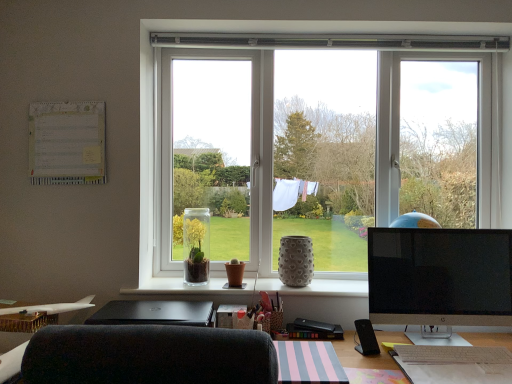
You are a GUI agent. You are given a task and a screenshot of the screen. Output one action in this format:
    pyautogui.click(x=<x>, y=<y>)
    Task: Click on the blank space situated above matte black stapler at lower center (from a real-world perspective)
    The height and width of the screenshot is (384, 512).
    Given the screenshot: What is the action you would take?
    pyautogui.click(x=310, y=326)